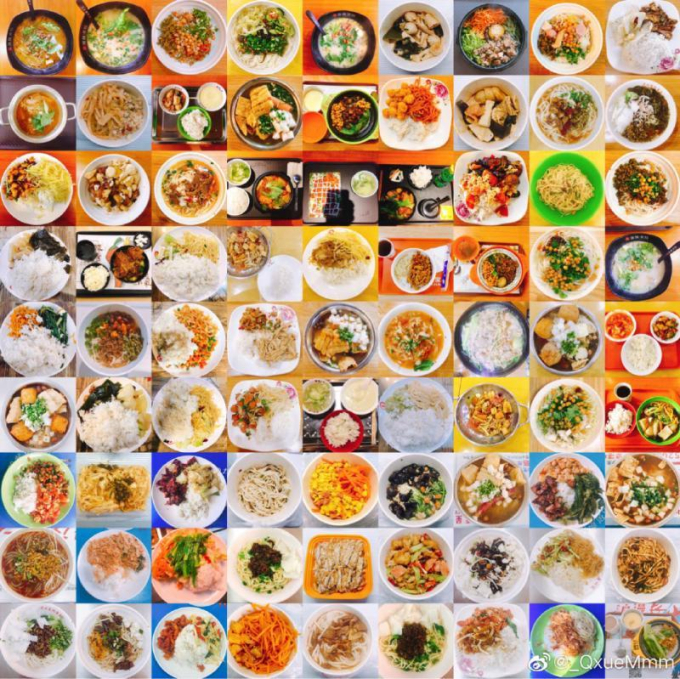
Find the location of a particular element. Image resolution: width=680 pixels, height=679 pixels. right row of photographs is located at coordinates (651, 37), (641, 113), (644, 189), (638, 259), (643, 341), (636, 414), (645, 485), (644, 559), (646, 636).